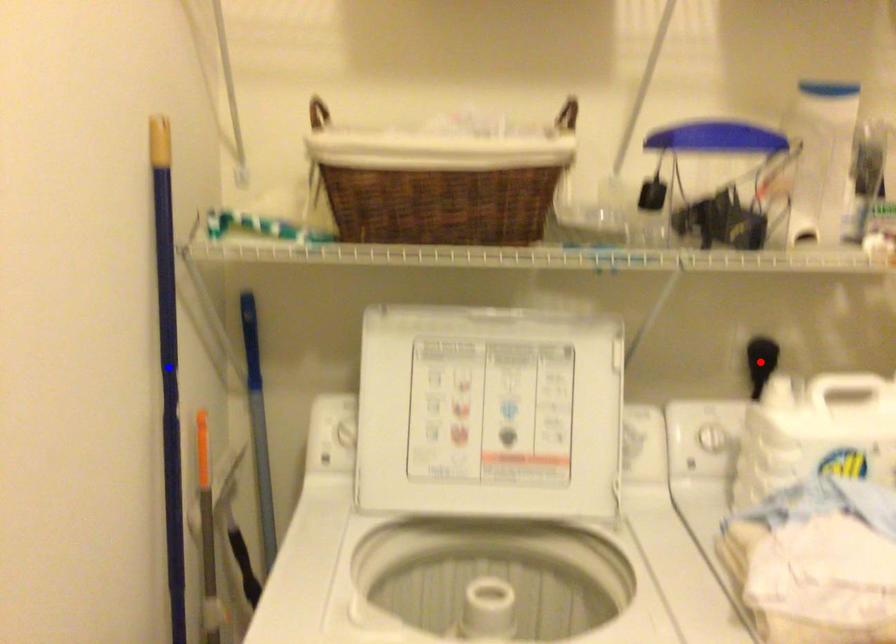
Question: Which of the two points in the image is closer to the camera?

Choices:
 (A) Blue point is closer.
 (B) Red point is closer.

Answer: (A)